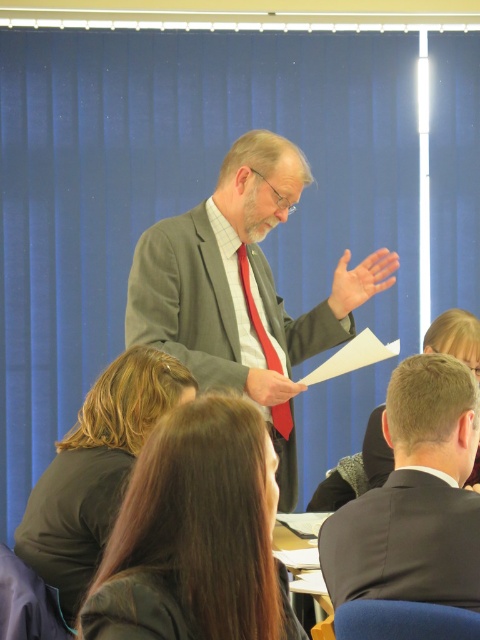
Can you confirm if brown hair at center is smaller than dark green fabric business suit at lower left?

Actually, brown hair at center might be larger than dark green fabric business suit at lower left.

Is brown hair at center above dark green fabric business suit at lower left?

Correct, brown hair at center is located above dark green fabric business suit at lower left.

Find the location of a particular element. brown hair at center is located at coordinates (195, 536).

Where is `brown hair at center`? The image size is (480, 640). brown hair at center is located at coordinates (195, 536).

Who is shorter, matte gray suit at center or dark green fabric business suit at lower left?

dark green fabric business suit at lower left

Is matte gray suit at center shorter than dark green fabric business suit at lower left?

Incorrect, matte gray suit at center's height does not fall short of dark green fabric business suit at lower left's.

Is point (228, 349) farther from camera compared to point (111, 486)?

That is True.

The height and width of the screenshot is (640, 480). Identify the location of matte gray suit at center. (228, 275).

Between dark gray suit at center and matte red tie at center, which one has less height?

matte red tie at center

Can you confirm if dark gray suit at center is taller than matte red tie at center?

Indeed, dark gray suit at center has a greater height compared to matte red tie at center.

This screenshot has height=640, width=480. In order to click on dark gray suit at center in this screenshot , I will do `click(415, 497)`.

Where is `dark gray suit at center`? The width and height of the screenshot is (480, 640). dark gray suit at center is located at coordinates (415, 497).